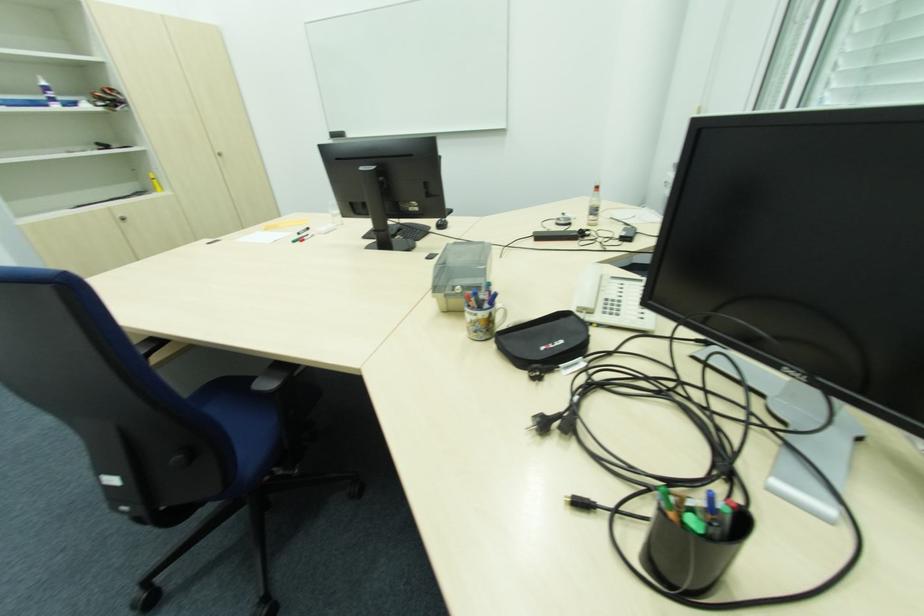
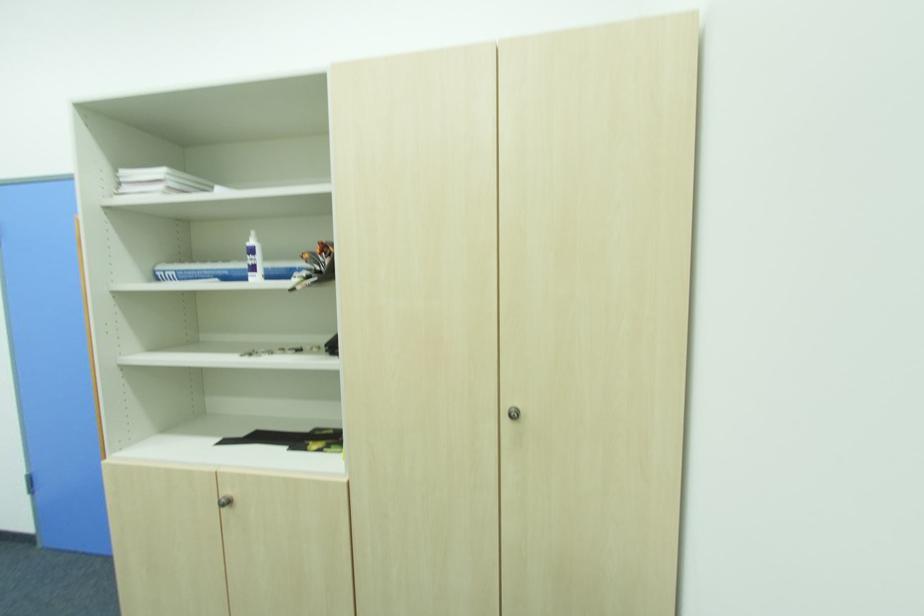
Find the pixel in the second image that matches (x=45, y=84) in the first image.

(254, 243)